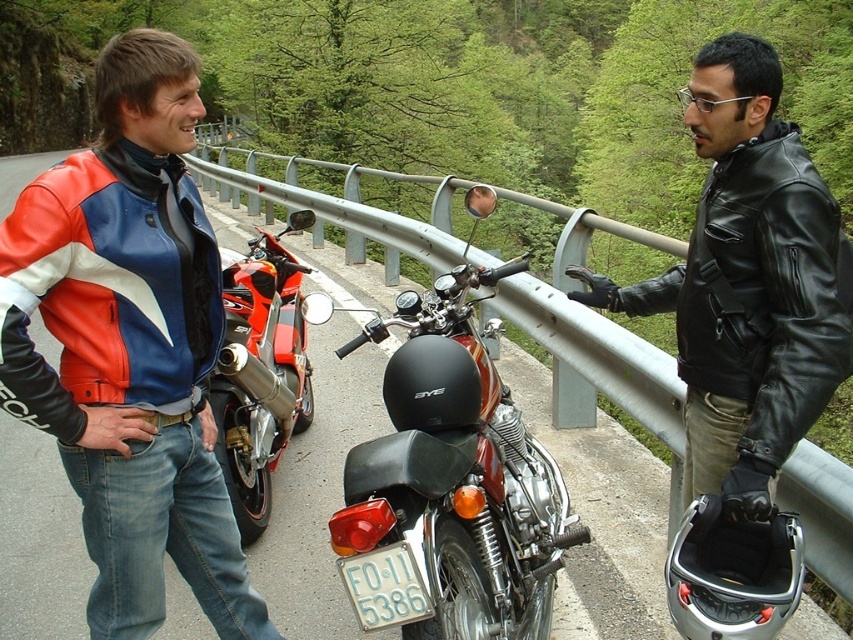
You are a delivery person who needs to deliver a package to the shiny chrome motorcycle at center. The license plate is required for identification. Can you easily access the white plastic license plate at center from your current position?

The white plastic license plate at center is behind the shiny chrome motorcycle at center, so you cannot easily access it from your current position unless you move around the motorcycle.

Consider the image. You are a photographer standing behind the two individuals and want to capture a photo that includes both the shiny chrome motorcycle at center and the white plastic license plate at center. Which object should you ensure is in focus first to make sure both are visible clearly in the photo?

The shiny chrome motorcycle at center is located above the white plastic license plate at center, so you should focus on the shiny chrome motorcycle at center first to ensure both are in focus since it is closer to the camera.

You are a photographer standing behind the two people in the scene. You want to take a photo that includes both the leather jacket at left and the shiny red sportbike at left. Which object should you focus on first to ensure both are in clear view?

The leather jacket at left is closer to the viewer than the shiny red sportbike at left, so you should focus on the leather jacket at left first to ensure both are in clear view.